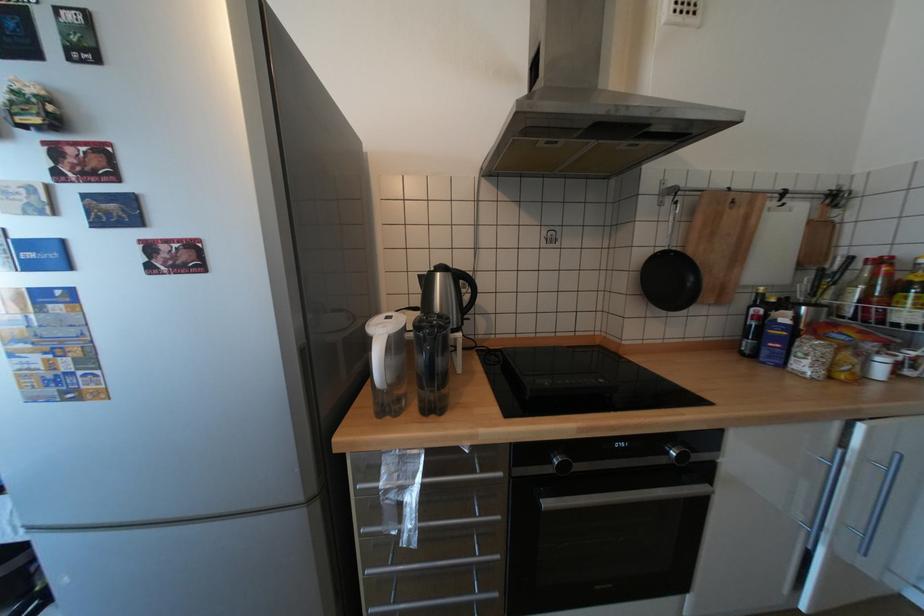
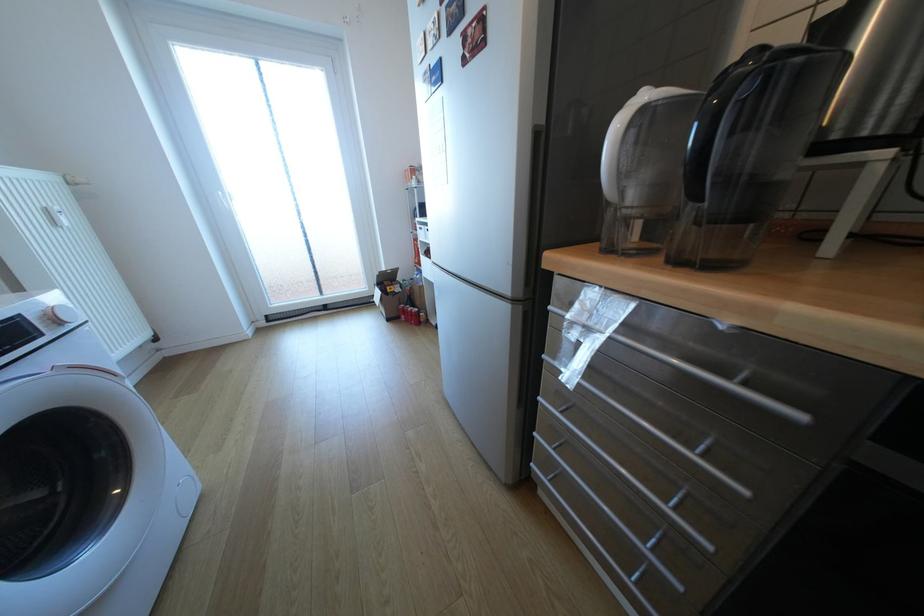
Where in the second image is the point corresponding to (x=392, y=488) from the first image?

(578, 320)